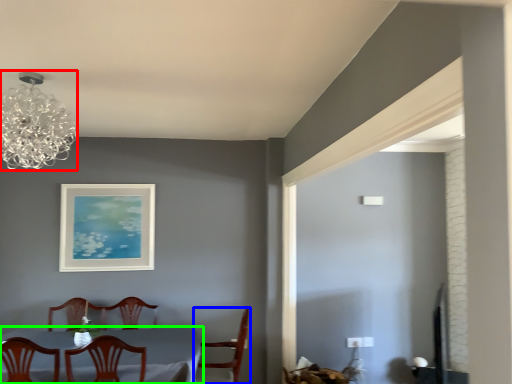
Question: Which is nearer to the lamp (highlighted by a red box)? chair (highlighted by a blue box) or table (highlighted by a green box).

Choices:
 (A) chair
 (B) table

Answer: (B)